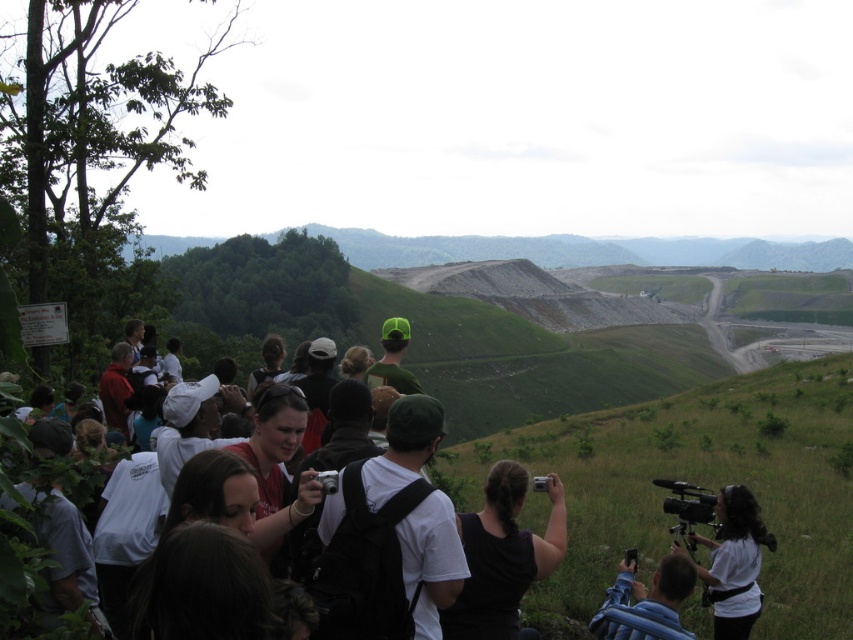
You are navigating through the crowd at the excavation site and need to place a marker exactly at the center of the image. Is the white matte backpack at center positioned closer to the marker or further away?

The white matte backpack at center is exactly at the center of the image since it is located at point (386, 467), which would be the center coordinates. Therefore, it is positioned right at the marker.